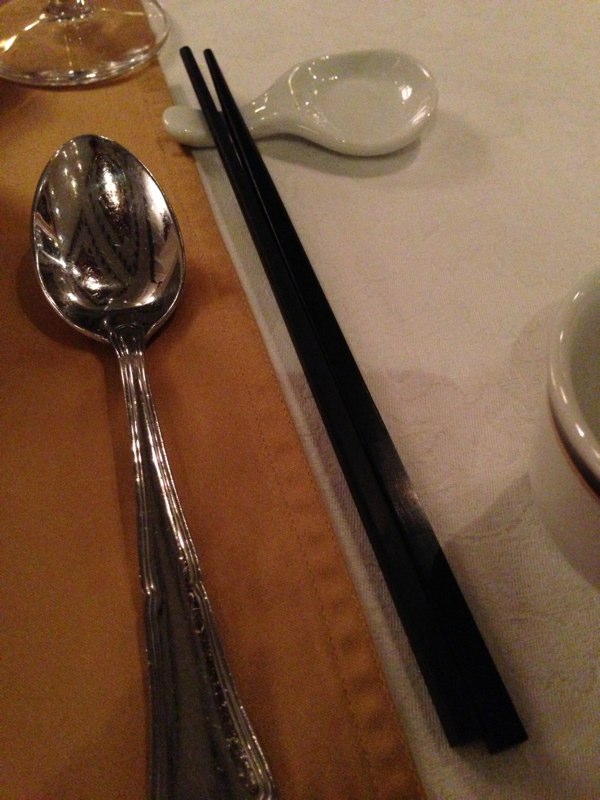
You are a GUI agent. You are given a task and a screenshot of the screen. Output one action in this format:
    pyautogui.click(x=<x>, y=<y>)
    Task: Click on the spoon
    The height and width of the screenshot is (800, 600).
    Given the screenshot: What is the action you would take?
    pyautogui.click(x=122, y=314)